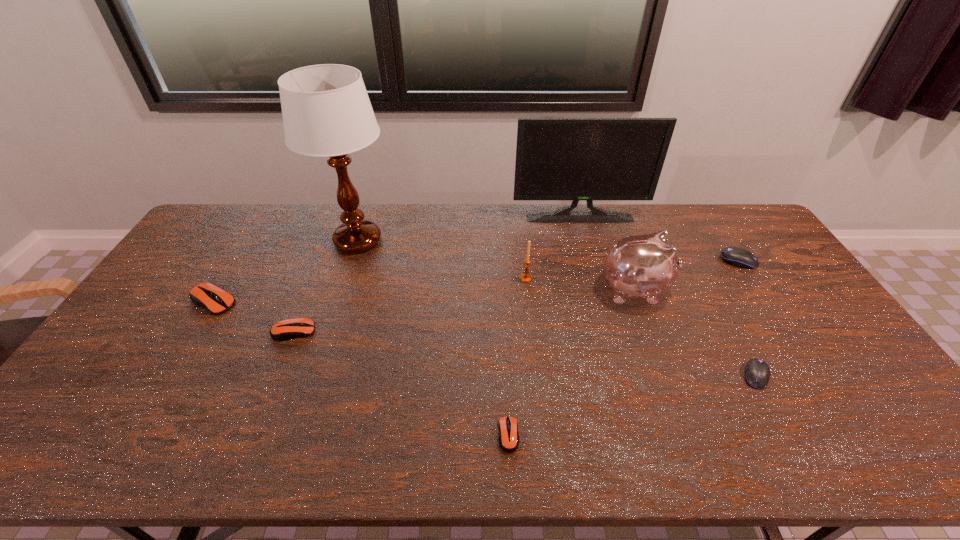
You are a GUI agent. You are given a task and a screenshot of the screen. Output one action in this format:
    pyautogui.click(x=<x>, y=<y>)
    Task: Click on the free spot that satisfies the following two spatial constraints: 1. on the front side of the leftmost computer mouse; 2. on the right side of the second nearest computer mouse
    
    Given the screenshot: What is the action you would take?
    pyautogui.click(x=168, y=375)

The width and height of the screenshot is (960, 540). What are the coordinates of `free location that satisfies the following two spatial constraints: 1. on the front facing side of the third tallest object; 2. on the back side of the bigger black computer mouse` in the screenshot? It's located at [625, 261].

This screenshot has width=960, height=540. In order to click on free space that satisfies the following two spatial constraints: 1. on the back side of the leftmost computer mouse; 2. on the right side of the candle_holder in this screenshot , I will do `click(228, 279)`.